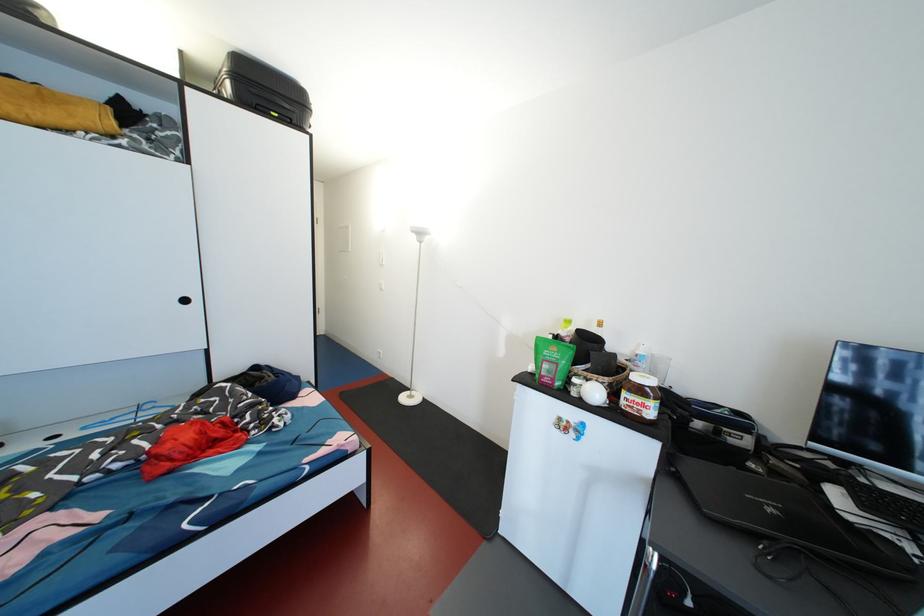
Which object does [639,397] point to?

This point indicates the Nutella jar.